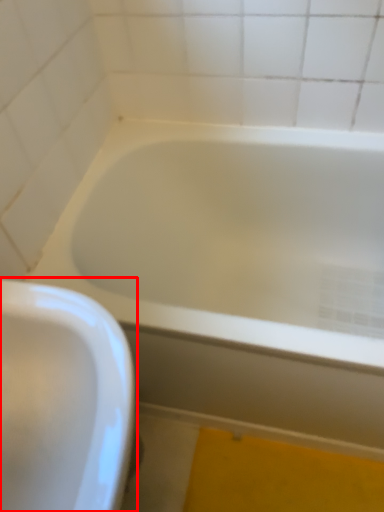
Question: In this image, where is sink (annotated by the red box) located relative to bathtub?

Choices:
 (A) right
 (B) left

Answer: (B)